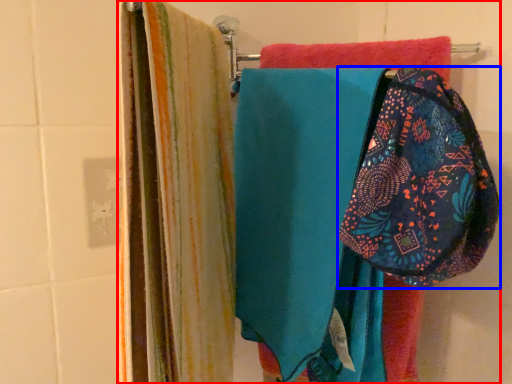
Question: Which object appears farthest to the camera in this image, laundry (highlighted by a red box) or pouch (highlighted by a blue box)?

Choices:
 (A) laundry
 (B) pouch

Answer: (A)